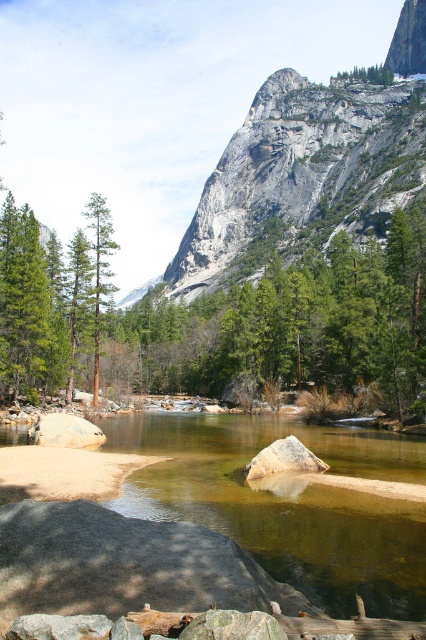
Question: Is clear water at center below green leafy tree at center?

Choices:
 (A) yes
 (B) no

Answer: (A)

Question: Which of the following is the farthest from the observer?

Choices:
 (A) gray rock mountain at upper center
 (B) green matte tree at upper center
 (C) green leafy tree at center
 (D) smooth gray rock at lower left

Answer: (B)

Question: Which point is closer to the camera taking this photo?

Choices:
 (A) (336, 264)
 (B) (69, 413)

Answer: (B)

Question: Where is green leafy tree at center located in relation to smooth gray rock at lower left in the image?

Choices:
 (A) above
 (B) below

Answer: (A)

Question: Which point is farther from the camera taking this photo?

Choices:
 (A) (178, 288)
 (B) (63, 424)
 (C) (250, 467)
 (D) (337, 516)

Answer: (A)

Question: Does gray rock mountain at upper center lie behind smooth gray rock at lower left?

Choices:
 (A) yes
 (B) no

Answer: (A)